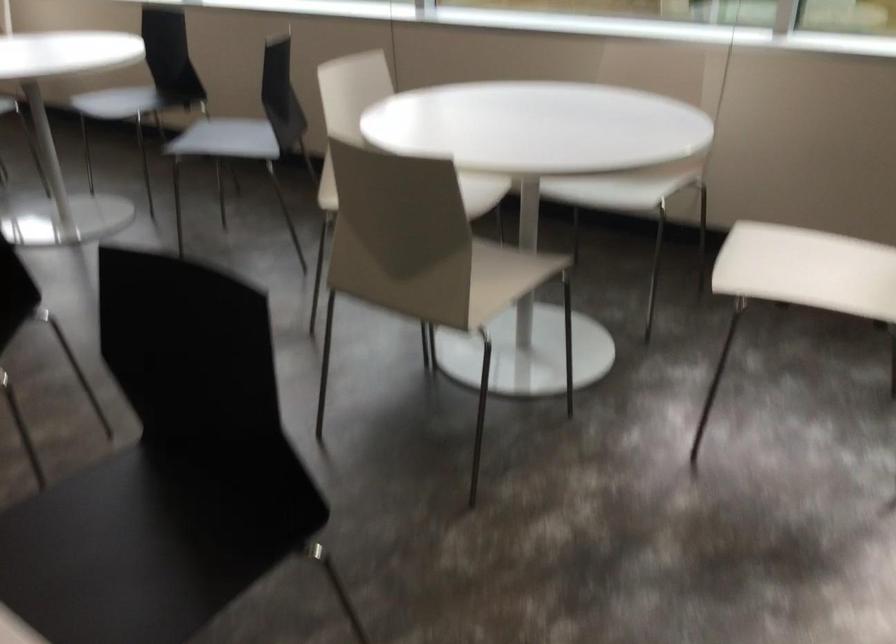
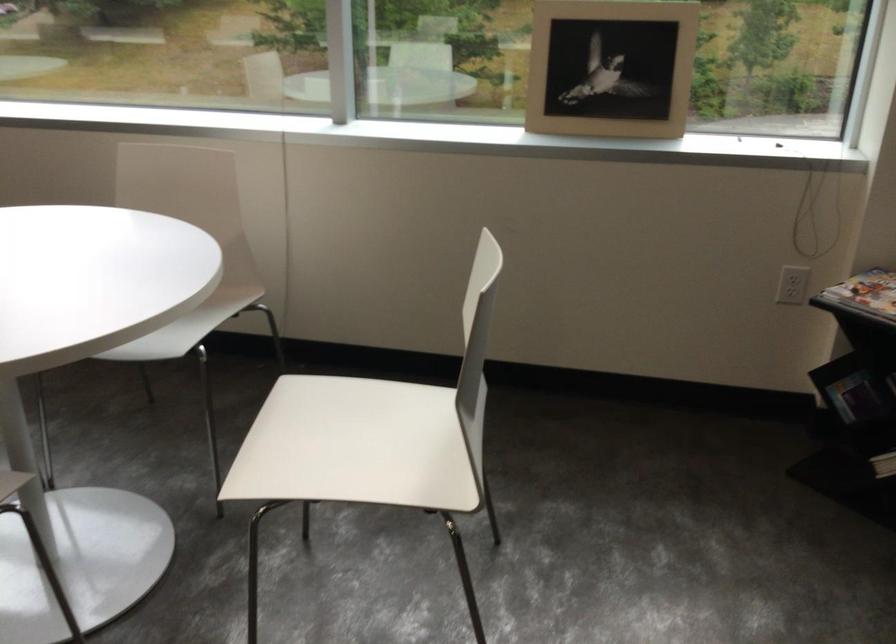
Find the pixel in the second image that matches point 636,190 in the first image.

(186, 327)